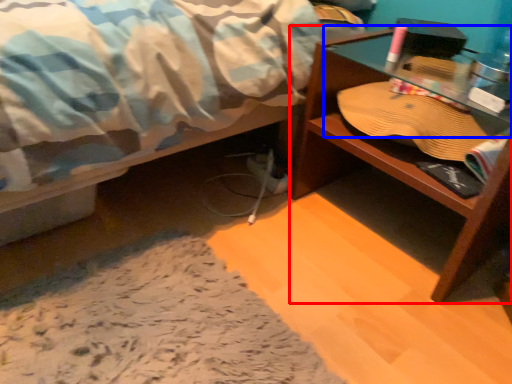
Question: Which of the following is the closest to the observer, desk (highlighted by a red box) or glass table (highlighted by a blue box)?

Choices:
 (A) desk
 (B) glass table

Answer: (A)